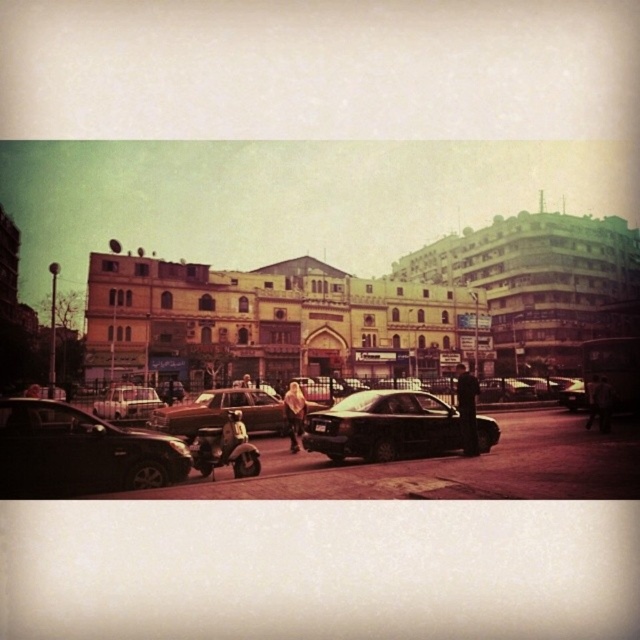
You are standing at point A, which is at coordinates point (x=115, y=426), and you want to move to point B at coordinates point (x=429, y=449). However, there is an obstacle between them. Which point is closer to you when you are at point A?

Point A is closer to you because you are already at point A. However, if the question refers to the distance between the two points, they are fixed coordinates. Please clarify your question.

You are a delivery driver who needs to park your vehicle in this area. You have a truck that is the same size as the shiny black car at lower left. There is a parking spot next to the matte silver sedan at center. Will your truck fit in that parking spot?

The shiny black car at lower left is larger than the matte silver sedan at center. Since your truck is the same size as the shiny black car at lower left, it may not fit in the parking spot next to the matte silver sedan at center, which is likely sized for smaller vehicles like the sedan.